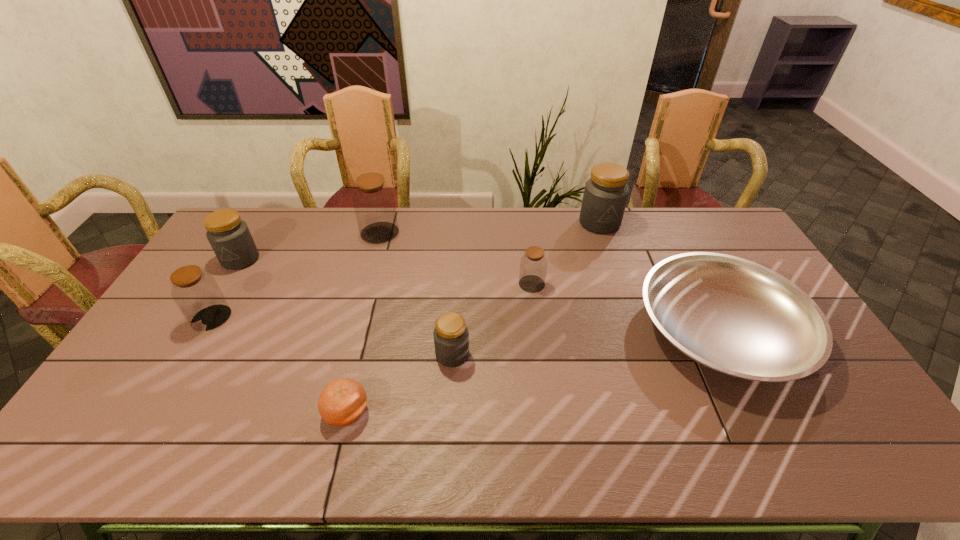
This screenshot has height=540, width=960. Identify the location of the nearest gray jar. (451, 337).

Locate an element on the screen. Image resolution: width=960 pixels, height=540 pixels. the smallest gray jar is located at coordinates (451, 337).

Find the location of `bedpan`. bedpan is located at coordinates (x=734, y=316).

The width and height of the screenshot is (960, 540). In order to click on clementine in this screenshot , I will do `click(341, 403)`.

Locate an element on the screen. vacant region located on the left of the second brown jar from right to left is located at coordinates (334, 233).

The width and height of the screenshot is (960, 540). What are the coordinates of `free spot located 0.140m on the surface of the farthest gray jar near the warning symbol` in the screenshot? It's located at (612, 260).

Where is `free space located on the front of the nearest brown jar`? This screenshot has width=960, height=540. free space located on the front of the nearest brown jar is located at coordinates click(176, 379).

Image resolution: width=960 pixels, height=540 pixels. I want to click on vacant space located on the surface of the sixth nearest object near the warning symbol, so click(x=226, y=284).

This screenshot has height=540, width=960. What are the coordinates of `blank space located 0.380m on the left of the second nearest brown jar` in the screenshot? It's located at (402, 284).

Locate an element on the screen. vacant space located on the surface of the smallest gray jar near the warning symbol is located at coordinates (577, 354).